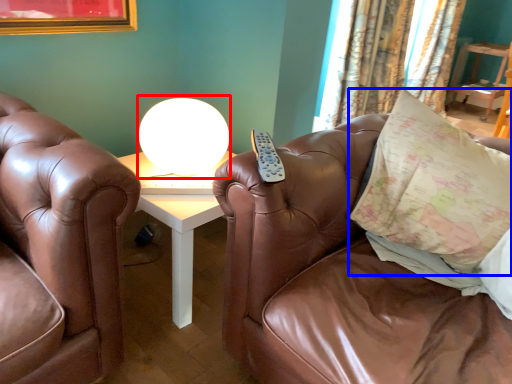
Question: Which point is closer to the camera, table lamp (highlighted by a red box) or pillow (highlighted by a blue box)?

Choices:
 (A) table lamp
 (B) pillow

Answer: (B)